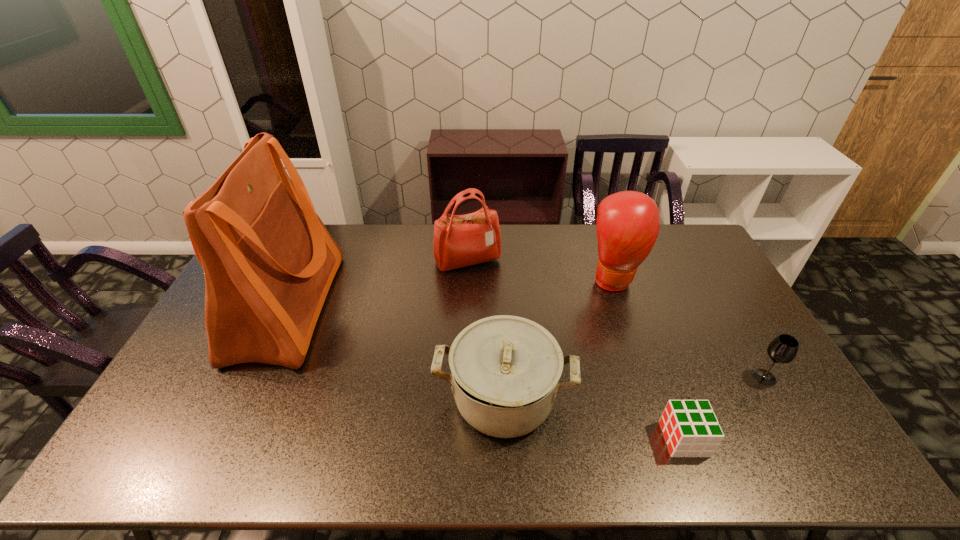
The image size is (960, 540). I want to click on vacant position in the image that satisfies the following two spatial constraints: 1. on the striking surface of the boxing glove; 2. on the right side of the wineglass, so click(648, 377).

Locate an element on the screen. vacant space that satisfies the following two spatial constraints: 1. on the striking surface of the second shortest object; 2. on the left side of the boxing glove is located at coordinates (648, 377).